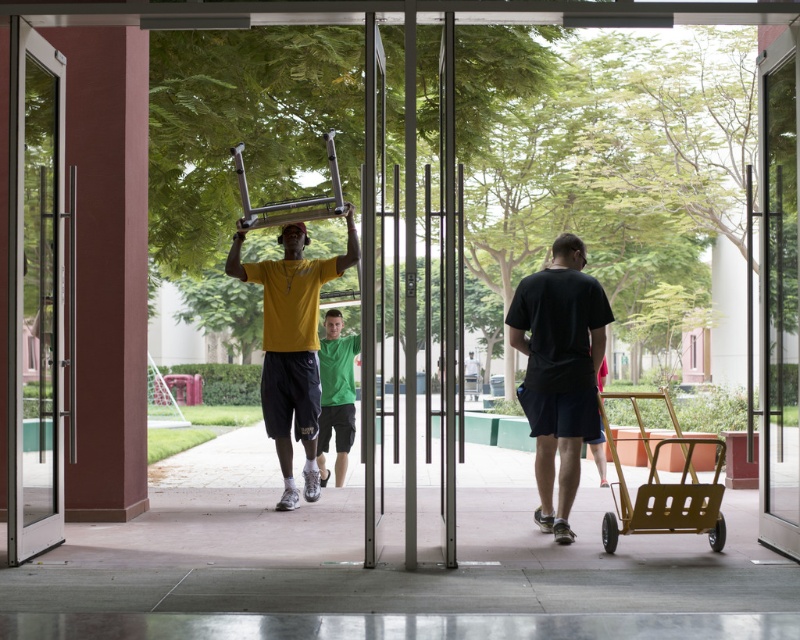
You are a delivery person trying to carry a large package that is 1.5 meters wide. You see the transparent glass door at center and the green matte head at center in the scene. Which object has a smaller width that might pose a challenge for moving the package through?

The transparent glass door at center has a width less than the green matte head at center, so the transparent glass door at center may pose a challenge for moving the 1.5 meters wide package through due to its narrower width.

Consider the image. You are standing at the entrance of the building and want to take a photo. There are two points marked on the ground where you can stand to capture the scene. The first point is at coordinate point (20, 492) and the second point is at coordinate point (413, 330). Which point should you choose if you want to be closer to the man carrying the metal chair?

You should choose point (20, 492) because it is closer to the man carrying the metal chair as it is further to the viewer compared to point (413, 330).